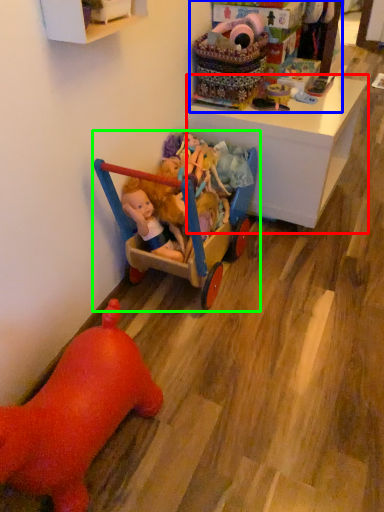
Question: Which object is the closest to the desk (highlighted by a red box)? Choose among these: toyshop (highlighted by a blue box) or toy (highlighted by a green box).

Choices:
 (A) toyshop
 (B) toy

Answer: (A)